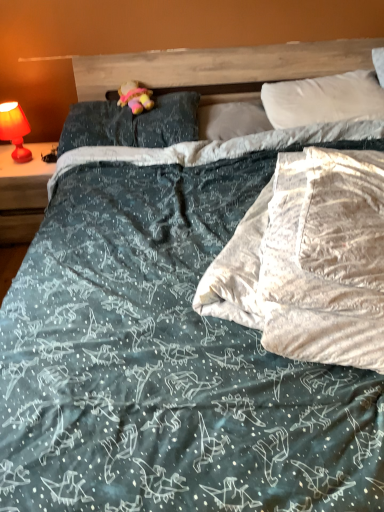
At what (x,y) coordinates should I click in order to perform the action: click on vacant space situated above white soft pillow at center, marked as the second pillow in a left-to-right arrangement (from a real-world perspective). Please return your answer as a coordinate pair (x, y). Looking at the image, I should click on (236, 104).